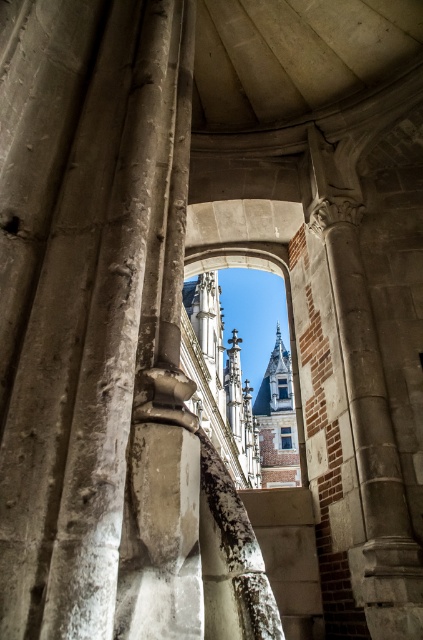
Between point (288, 444) and point (282, 392), which one is positioned behind?

Positioned behind is point (282, 392).

Is blue glass window at center to the right of clear glass window at center from the viewer's perspective?

No, blue glass window at center is not to the right of clear glass window at center.

Which is behind, point (282, 436) or point (282, 394)?

The point (282, 394) is more distant.

Find the location of `blue glass window at center`. blue glass window at center is located at coordinates (285, 436).